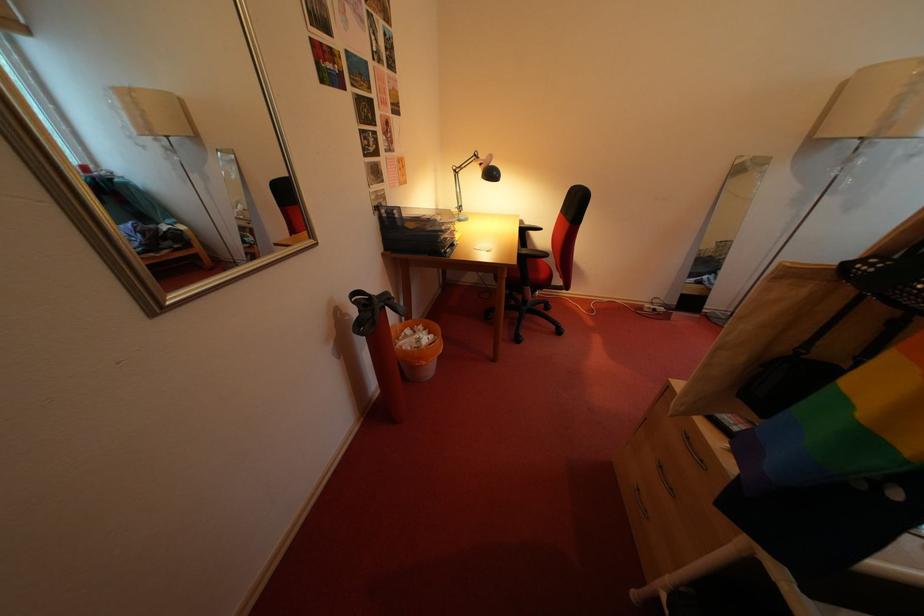
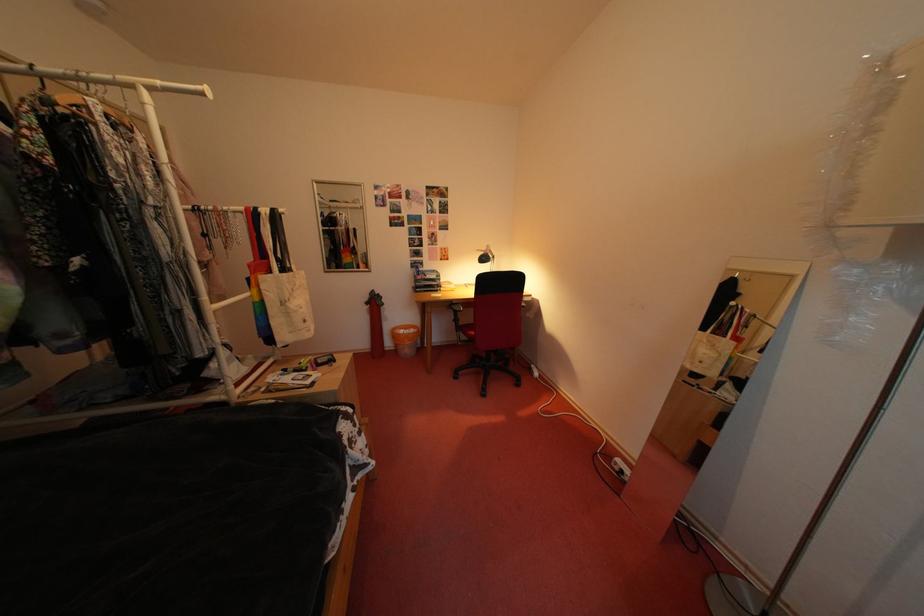
Question: I am providing you with two images of the same scene from different viewpoints. After the viewpoint changes to image2, which objects are now occluded?

Choices:
 (A) black printer
 (B) black desk lamp
 (C) orange wastebasket
 (D) yellow book

Answer: (A)